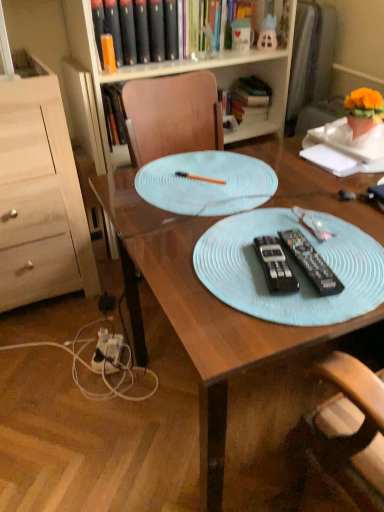
This screenshot has height=512, width=384. What are the coordinates of `vacant space situated above light blue fabric placemat at center (from a real-world perspective)` in the screenshot? It's located at (287, 251).